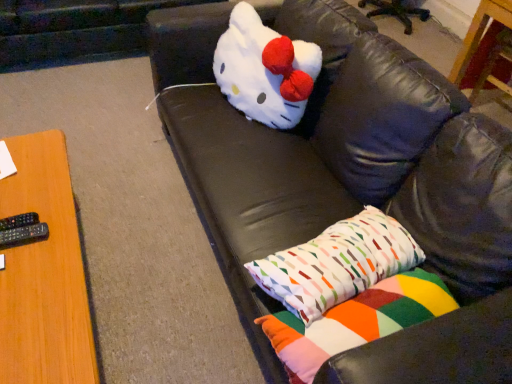
You are a GUI agent. You are given a task and a screenshot of the screen. Output one action in this format:
    pyautogui.click(x=<x>, y=<y>)
    Task: Click on the vacant point above multicolored fabric pillow at lower right, the second pillow when ordered from top to bottom (from a real-world perspective)
    
    Given the screenshot: What is the action you would take?
    pyautogui.click(x=356, y=319)